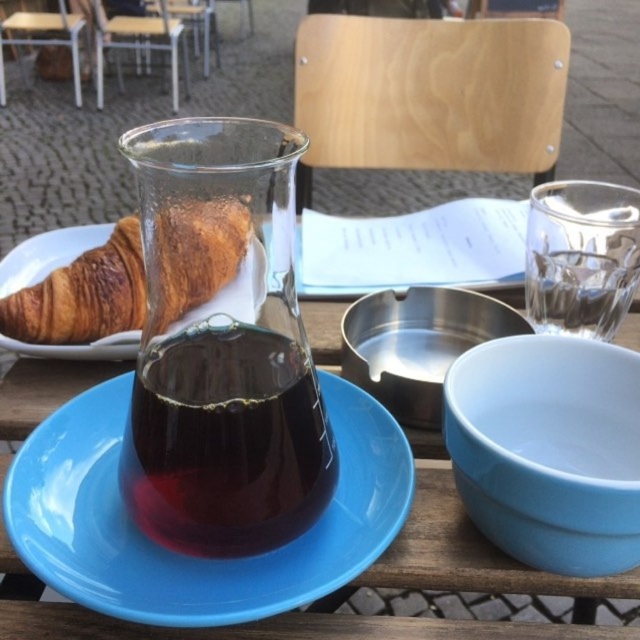
Question: Is light blue ceramic bowl at right smaller than shiny metallic bowl at center?

Choices:
 (A) yes
 (B) no

Answer: (B)

Question: Is transparent glass carafe at center wider than shiny metallic bowl at center?

Choices:
 (A) yes
 (B) no

Answer: (A)

Question: Which of the following is the closest to the observer?

Choices:
 (A) dark glass carafe at center
 (B) transparent glass carafe at center
 (C) light blue ceramic bowl at right
 (D) blue ceramic saucer at center

Answer: (D)

Question: Among these objects, which one is nearest to the camera?

Choices:
 (A) blue ceramic saucer at center
 (B) dark glass carafe at center

Answer: (A)

Question: Is dark glass carafe at center closer to the viewer compared to shiny metallic bowl at center?

Choices:
 (A) no
 (B) yes

Answer: (B)

Question: Estimate the real-world distances between objects in this image. Which object is farther from the shiny metallic bowl at center?

Choices:
 (A) transparent glass carafe at center
 (B) golden brown croissant at center
 (C) blue ceramic saucer at center
 (D) dark glass carafe at center

Answer: (B)